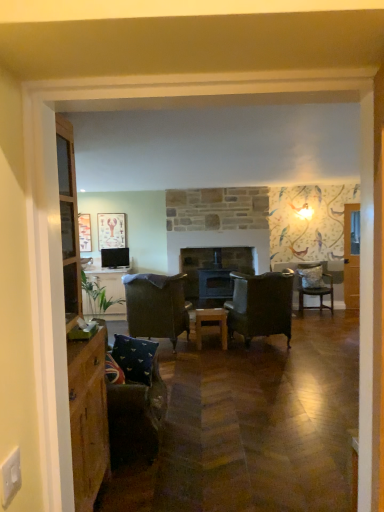
Question: Does wooden table at center have a smaller size compared to velvet dark brown chair at right, the 3th chair when ordered from front to back?

Choices:
 (A) no
 (B) yes

Answer: (B)

Question: Is wooden table at center bigger than velvet dark brown chair at right, acting as the third chair starting from the left?

Choices:
 (A) no
 (B) yes

Answer: (A)

Question: Does wooden table at center have a greater height compared to velvet dark brown chair at right, the 3th chair when ordered from front to back?

Choices:
 (A) no
 (B) yes

Answer: (A)

Question: From a real-world perspective, is wooden table at center below velvet dark brown chair at right, the 1th chair from the right?

Choices:
 (A) no
 (B) yes

Answer: (B)

Question: From the image's perspective, is wooden table at center over velvet dark brown chair at right, the 3th chair when ordered from front to back?

Choices:
 (A) no
 (B) yes

Answer: (A)

Question: Is wooden table at center touching velvet dark brown chair at right, acting as the third chair starting from the left?

Choices:
 (A) yes
 (B) no

Answer: (B)

Question: Can you confirm if matte wooden picture frame at upper left, acting as the first picture frame starting from the right, is positioned to the left of velvet dark brown armchair at center, acting as the second chair starting from the back?

Choices:
 (A) no
 (B) yes

Answer: (B)

Question: Is matte wooden picture frame at upper left, the second picture frame in the left-to-right sequence, far from velvet dark brown armchair at center, the first chair positioned from the left?

Choices:
 (A) yes
 (B) no

Answer: (A)

Question: Considering the relative positions of matte wooden picture frame at upper left, acting as the first picture frame starting from the right, and velvet dark brown armchair at center, which appears as the 3th chair when viewed from the right, in the image provided, is matte wooden picture frame at upper left, acting as the first picture frame starting from the right, in front of velvet dark brown armchair at center, which appears as the 3th chair when viewed from the right,?

Choices:
 (A) yes
 (B) no

Answer: (B)

Question: Can you confirm if matte wooden picture frame at upper left, the second picture frame in the left-to-right sequence, is thinner than velvet dark brown armchair at center, the first chair positioned from the left?

Choices:
 (A) yes
 (B) no

Answer: (A)

Question: Does matte wooden picture frame at upper left, the second picture frame in the left-to-right sequence, touch velvet dark brown armchair at center, which appears as the 3th chair when viewed from the right?

Choices:
 (A) yes
 (B) no

Answer: (B)

Question: From a real-world perspective, is matte wooden picture frame at upper left, the second picture frame in the left-to-right sequence, over velvet dark brown armchair at center, the first chair positioned from the left?

Choices:
 (A) no
 (B) yes

Answer: (B)

Question: Does wooden stove at center have a greater width compared to blue fabric pillow at lower left?

Choices:
 (A) yes
 (B) no

Answer: (A)